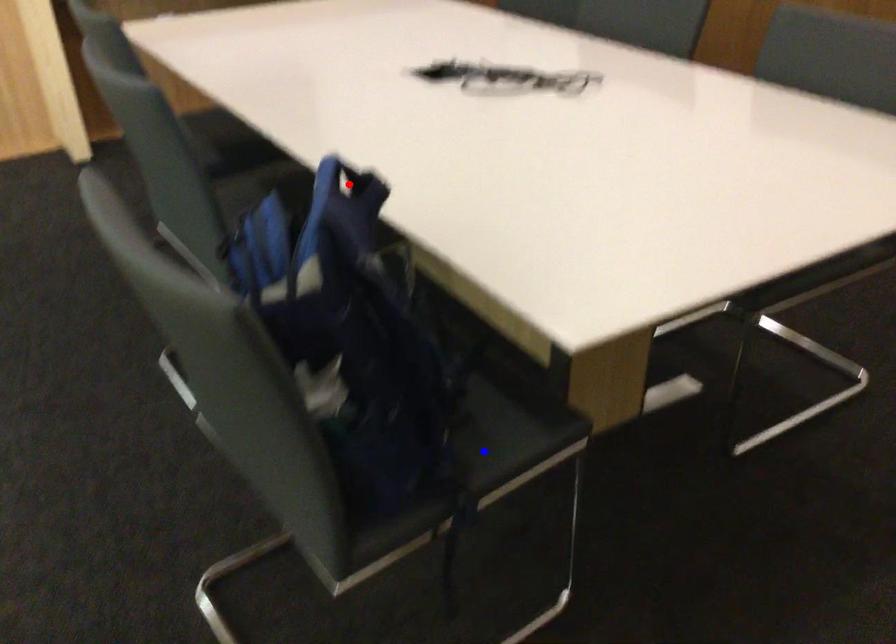
Question: In the image, two points are highlighted. Which point is nearer to the camera? Reply with the corresponding letter.

Choices:
 (A) blue point
 (B) red point

Answer: (B)